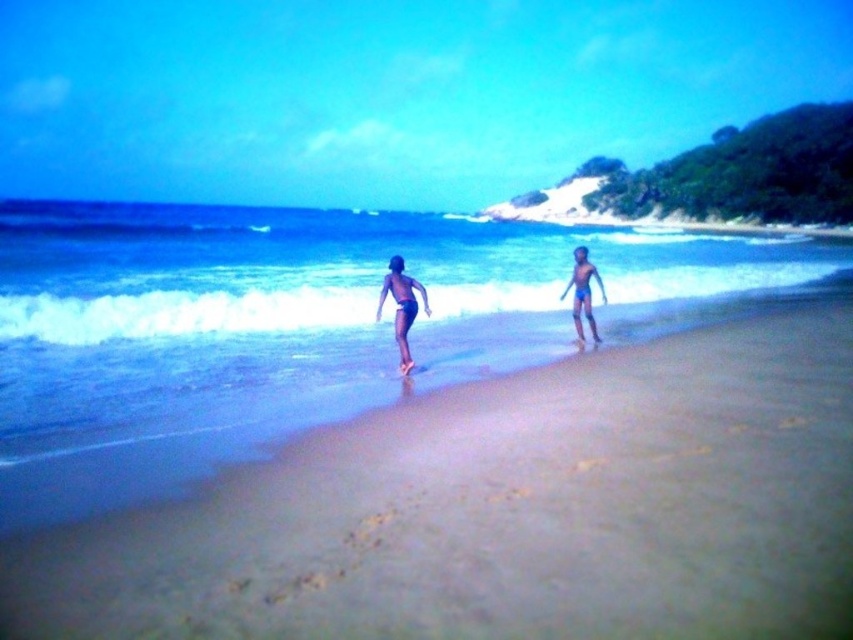
You are a photographer trying to capture the scene of the beach. You want to place a new object at the coordinates where the matte blue shorts at center are located. What object is currently at those coordinates?

The matte blue shorts at center are currently located at the coordinates point (401, 307).

You are a photographer standing on the beach and want to take a photo of the blue water at center and the dark blue swim trunks at center. Which object should you focus on first if you want to capture both in sharp focus?

The dark blue swim trunks at center are closer to you than the blue water at center. To capture both in sharp focus, you should focus on the dark blue swim trunks at center first since it is closer, ensuring the blue water at center will also be in focus due to depth of field.